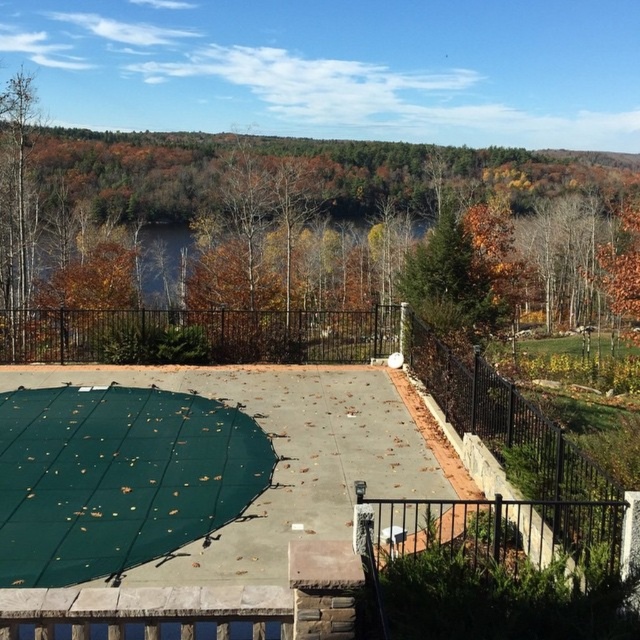
You are planning to install a new fence in your backyard. You have two options from the image, the green matte fence at upper center and the green mesh at center. Which one is bigger in size?

The green matte fence at upper center is larger in size compared to the green mesh at center.

You are standing on the patio and want to see over the green matte fence at upper center to look at the forest. Can you see over the green mesh at center as well?

The green matte fence at upper center is much taller than the green mesh at center. Since you can see over the taller fence, you can definitely see over the green mesh at center.